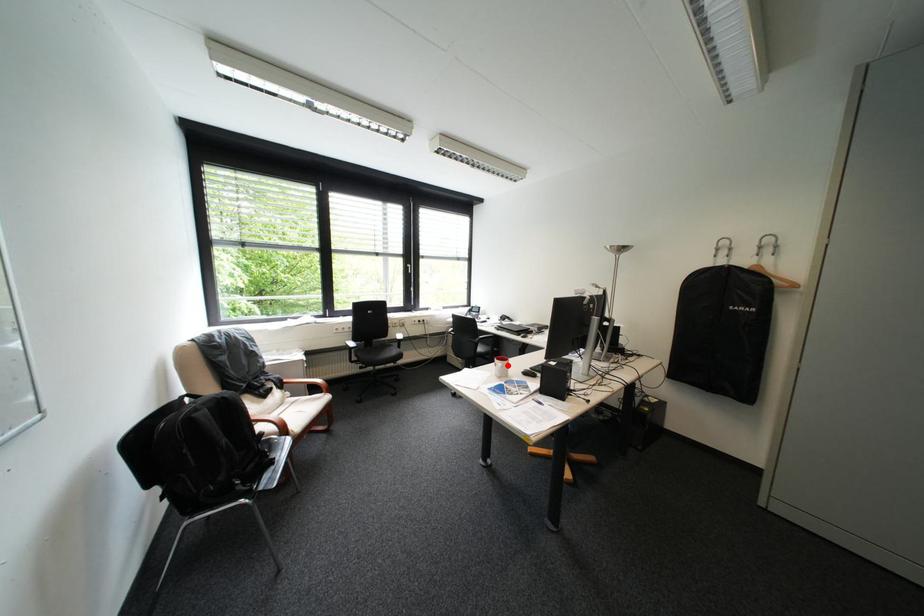
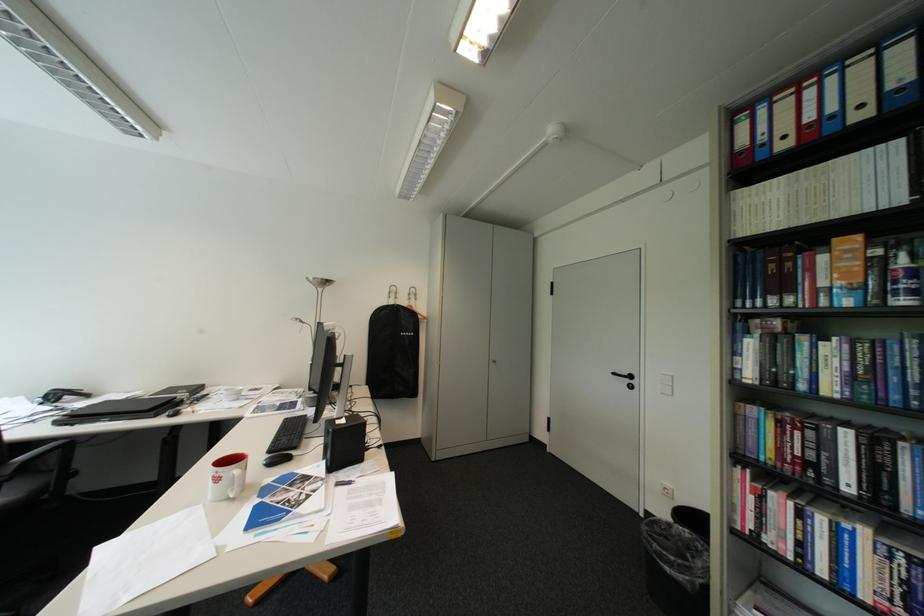
Find the pixel in the second image that matches the highlighted location in the first image.

(228, 480)